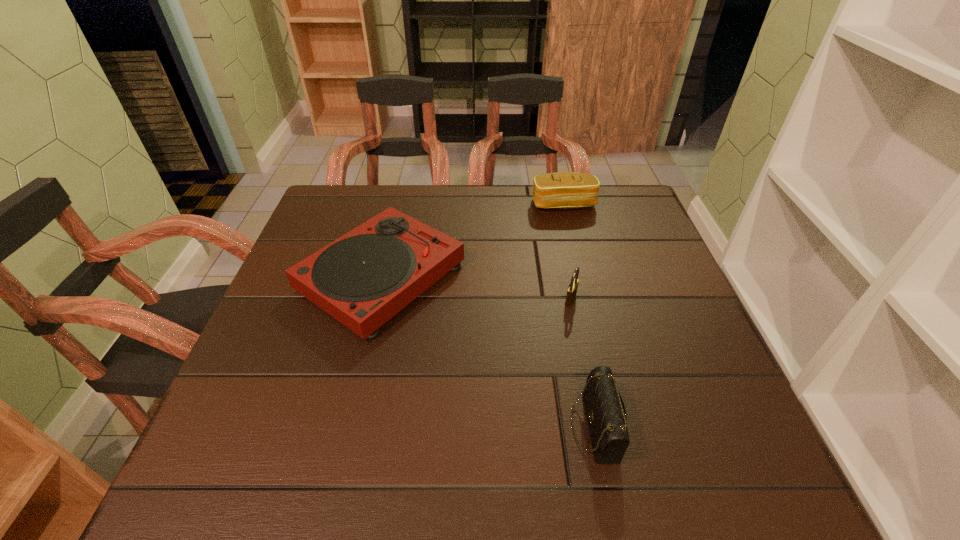
What are the coordinates of `vacant position at the right edge of the desktop` in the screenshot? It's located at (692, 415).

Identify the location of blank space at the far left corner of the desktop. (344, 186).

You are a GUI agent. You are given a task and a screenshot of the screen. Output one action in this format:
    pyautogui.click(x=<x>, y=<y>)
    Task: Click on the free space between the nearest object and the leftmost object
    The width and height of the screenshot is (960, 540).
    Given the screenshot: What is the action you would take?
    pyautogui.click(x=488, y=352)

I want to click on free space between the farthest object and the padlock, so click(x=567, y=252).

This screenshot has width=960, height=540. I want to click on vacant point located between the nearest object and the padlock, so click(583, 363).

This screenshot has height=540, width=960. In order to click on vacant region between the padlock and the farther clutch bag in this screenshot , I will do `click(567, 252)`.

The height and width of the screenshot is (540, 960). I want to click on vacant area that lies between the nearer clutch bag and the farthest object, so click(579, 315).

Locate an element on the screen. vacant space that's between the padlock and the nearest object is located at coordinates (583, 363).

Where is `vacant area that lies between the record player and the nearer clutch bag`? The width and height of the screenshot is (960, 540). vacant area that lies between the record player and the nearer clutch bag is located at coordinates (488, 352).

This screenshot has height=540, width=960. Identify the location of free spot between the nearest object and the padlock. (583, 363).